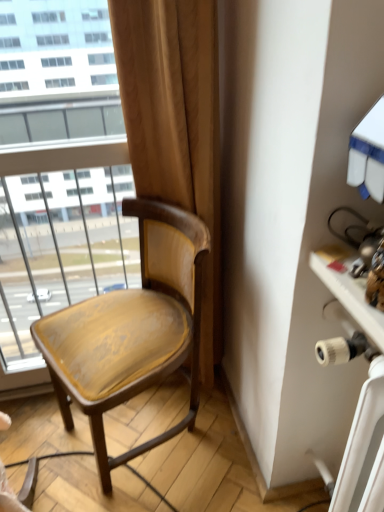
Question: From the image's perspective, is wooden chair at center located above or below white plastic table at right?

Choices:
 (A) above
 (B) below

Answer: (A)

Question: From a real-world perspective, is wooden chair at center physically located above or below white plastic table at right?

Choices:
 (A) below
 (B) above

Answer: (A)

Question: In terms of height, does wooden chair at center look taller or shorter compared to white plastic table at right?

Choices:
 (A) short
 (B) tall

Answer: (B)

Question: Considering the positions of white plastic table at right and wooden chair at center in the image, is white plastic table at right taller or shorter than wooden chair at center?

Choices:
 (A) short
 (B) tall

Answer: (A)

Question: From a real-world perspective, is white plastic table at right positioned above or below wooden chair at center?

Choices:
 (A) above
 (B) below

Answer: (A)

Question: From the image's perspective, relative to wooden chair at center, is white plastic table at right above or below?

Choices:
 (A) above
 (B) below

Answer: (B)

Question: Is white plastic table at right to the left or to the right of wooden chair at center in the image?

Choices:
 (A) left
 (B) right

Answer: (B)